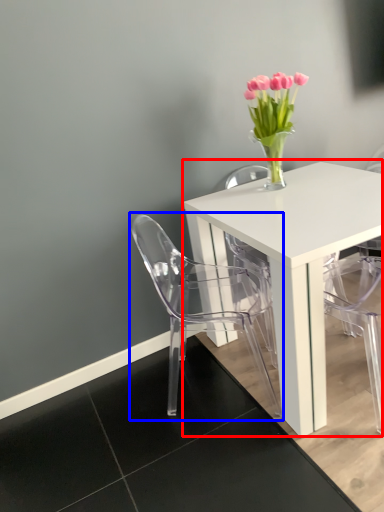
Question: Which object is closer to the camera taking this photo, table (highlighted by a red box) or chair (highlighted by a blue box)?

Choices:
 (A) table
 (B) chair

Answer: (A)